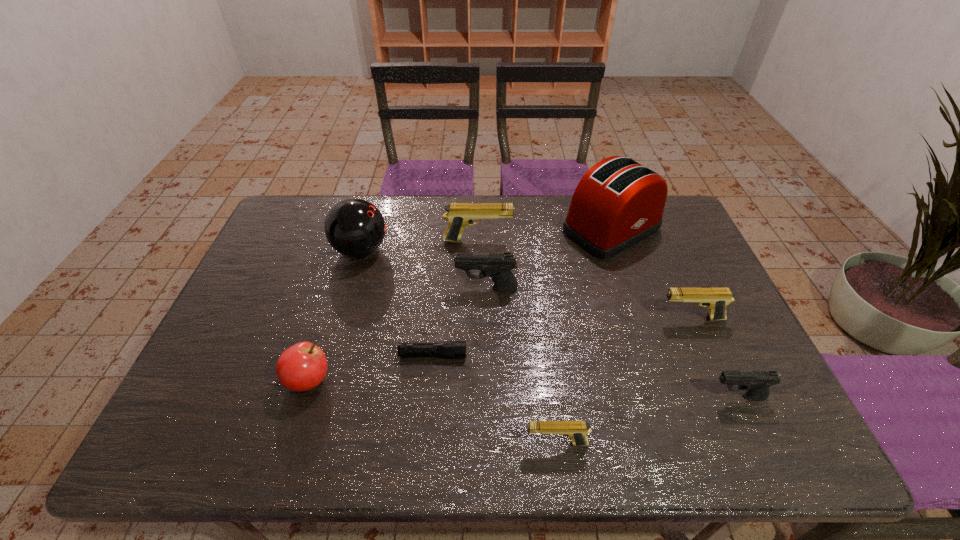
Find the location of `vacant space located at the barrel of the left black pistol`. vacant space located at the barrel of the left black pistol is located at coordinates (391, 289).

This screenshot has width=960, height=540. In order to click on free space located 0.070m at the barrel of the left black pistol in this screenshot , I will do `click(432, 289)`.

Where is `free space located 0.320m at the barrel of the left black pistol`? free space located 0.320m at the barrel of the left black pistol is located at coordinates (346, 289).

Where is `vacant space positioned at the barrel of the second nearest tan pistol`? vacant space positioned at the barrel of the second nearest tan pistol is located at coordinates (611, 319).

At what (x,y) coordinates should I click in order to perform the action: click on free location located 0.220m at the barrel of the second nearest tan pistol. Please return your answer as a coordinate pair (x, y). The width and height of the screenshot is (960, 540). Looking at the image, I should click on (577, 319).

Locate an element on the screen. This screenshot has height=540, width=960. vacant space situated at the barrel of the second nearest tan pistol is located at coordinates (599, 319).

This screenshot has width=960, height=540. What are the coordinates of `vacant space located 0.150m on the left of the apple` in the screenshot? It's located at (224, 380).

Locate an element on the screen. blank area located 0.090m at the barrel of the smaller black pistol is located at coordinates (670, 397).

Identify the location of vacant point located 0.330m at the barrel of the smaller black pistol. Image resolution: width=960 pixels, height=540 pixels. (568, 397).

Locate an element on the screen. The height and width of the screenshot is (540, 960). vacant space located at the barrel of the smaller black pistol is located at coordinates (547, 397).